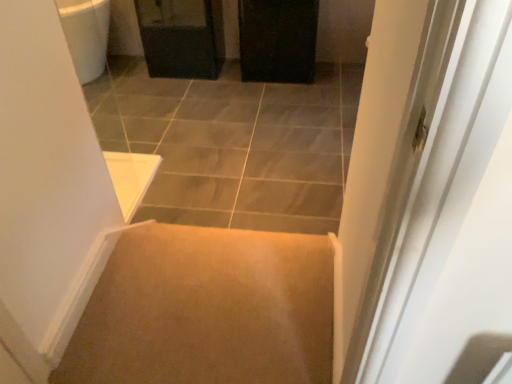
Question: Does carpet at center come behind matte black cabinet at upper center?

Choices:
 (A) yes
 (B) no

Answer: (B)

Question: Is carpet at center taller than matte black cabinet at upper center?

Choices:
 (A) yes
 (B) no

Answer: (B)

Question: Is carpet at center positioned before matte black cabinet at upper center?

Choices:
 (A) no
 (B) yes

Answer: (B)

Question: From a real-world perspective, is carpet at center physically above matte black cabinet at upper center?

Choices:
 (A) no
 (B) yes

Answer: (A)

Question: From the image's perspective, is carpet at center on matte black cabinet at upper center?

Choices:
 (A) yes
 (B) no

Answer: (B)

Question: From the image's perspective, is carpet at center under matte black cabinet at upper center?

Choices:
 (A) yes
 (B) no

Answer: (A)

Question: Does matte black cabinet at upper center have a greater width compared to black matte cabinet at upper center?

Choices:
 (A) no
 (B) yes

Answer: (B)

Question: From the image's perspective, is matte black cabinet at upper center below black matte cabinet at upper center?

Choices:
 (A) no
 (B) yes

Answer: (A)

Question: Does matte black cabinet at upper center come in front of black matte cabinet at upper center?

Choices:
 (A) yes
 (B) no

Answer: (B)

Question: From the image's perspective, is matte black cabinet at upper center on top of black matte cabinet at upper center?

Choices:
 (A) no
 (B) yes

Answer: (B)

Question: Is matte black cabinet at upper center aimed at black matte cabinet at upper center?

Choices:
 (A) no
 (B) yes

Answer: (A)

Question: Is matte black cabinet at upper center looking in the opposite direction of black matte cabinet at upper center?

Choices:
 (A) yes
 (B) no

Answer: (B)

Question: From a real-world perspective, is carpet at center positioned under black matte cabinet at upper center based on gravity?

Choices:
 (A) yes
 (B) no

Answer: (A)